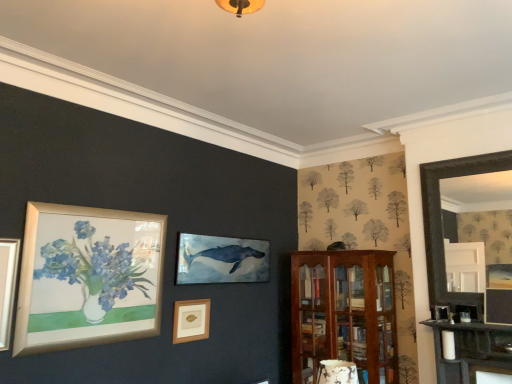
Question: From a real-world perspective, relative to black wooden fireplace at right, is wooden picture frame at center vertically above or below?

Choices:
 (A) below
 (B) above

Answer: (A)

Question: In the image, is wooden picture frame at center on the left side or the right side of black wooden fireplace at right?

Choices:
 (A) right
 (B) left

Answer: (B)

Question: Considering the real-world distances, which object is closest to the mahogany wooden cabinet at right?

Choices:
 (A) black wooden fireplace at right
 (B) wooden picture frame at center

Answer: (A)

Question: Considering the real-world distances, which object is closest to the black wooden fireplace at right?

Choices:
 (A) mahogany wooden cabinet at right
 (B) wooden picture frame at center

Answer: (A)